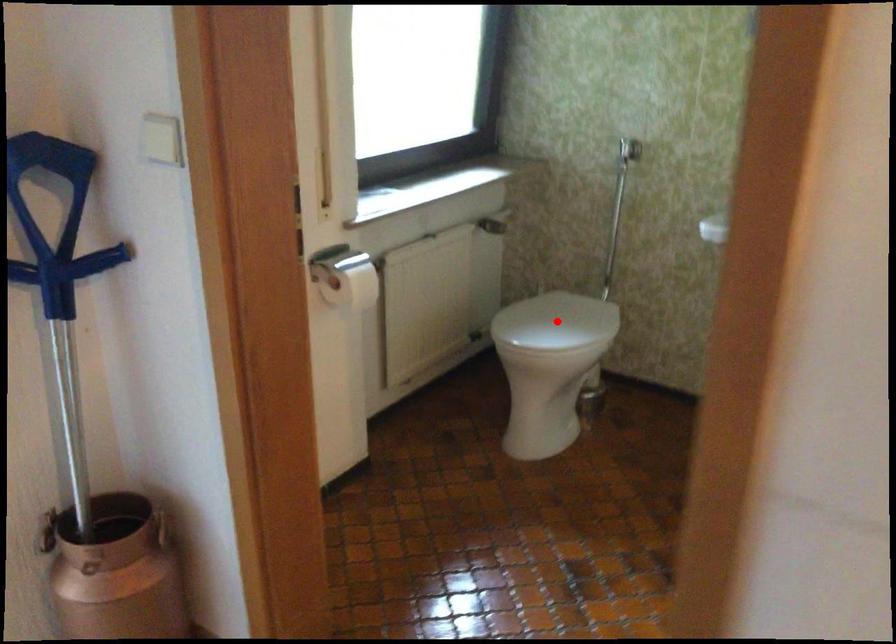
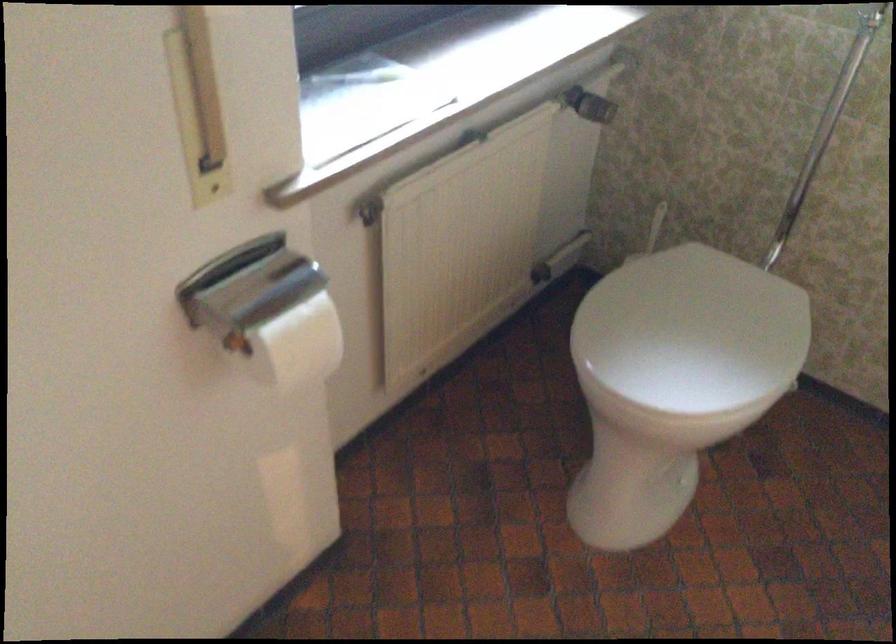
Find the pixel in the second image that matches the highlighted location in the first image.

(692, 330)